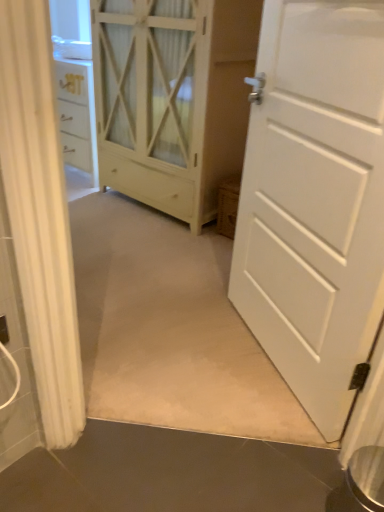
Identify the location of white matte door at right. (315, 200).

Measure the distance between white matte door at right and camera.

They are 37.42 inches apart.

What do you see at coordinates (315, 200) in the screenshot? The width and height of the screenshot is (384, 512). I see `white matte door at right` at bounding box center [315, 200].

What is the approximate width of white wood cupboard at center?

It is 22.03 inches.

Image resolution: width=384 pixels, height=512 pixels. What do you see at coordinates (173, 98) in the screenshot?
I see `white wood cupboard at center` at bounding box center [173, 98].

The image size is (384, 512). What are the coordinates of `white wood cupboard at center` in the screenshot? It's located at (173, 98).

Where is `white matte door at right`? white matte door at right is located at coordinates (315, 200).

Is white matte door at right at the right side of white wood cupboard at center?

Indeed, white matte door at right is positioned on the right side of white wood cupboard at center.

Relative to white wood cupboard at center, is white matte door at right in front or behind?

In the image, white matte door at right appears in front of white wood cupboard at center.

Is point (248, 213) positioned behind point (106, 47)?

No.

From the image's perspective, relative to white wood cupboard at center, is white matte door at right above or below?

white matte door at right is situated lower than white wood cupboard at center in the image.

From a real-world perspective, is white matte door at right physically located above or below white wood cupboard at center?

In terms of real-world spatial position, white matte door at right is below white wood cupboard at center.

In terms of width, does white matte door at right look wider or thinner when compared to white wood cupboard at center?

Considering their sizes, white matte door at right looks slimmer than white wood cupboard at center.

Between white matte door at right and white wood cupboard at center, which one has more height?

Standing taller between the two is white wood cupboard at center.

Which of these two, white matte door at right or white wood cupboard at center, is smaller?

white matte door at right.

Do you think white matte door at right is within white wood cupboard at center, or outside of it?

The correct answer is: outside.

Is white matte door at right directly adjacent to white wood cupboard at center?

No.

Could you tell me if white matte door at right is turned towards white wood cupboard at center?

No, white matte door at right is not turned towards white wood cupboard at center.

Can you tell me how much white matte door at right and white wood cupboard at center differ in facing direction?

30 degrees.

This screenshot has height=512, width=384. Find the location of `cupboard above the white matte door at right (from the image's perspective)`. cupboard above the white matte door at right (from the image's perspective) is located at coordinates (173, 98).

Which is more to the left, white wood cupboard at center or white matte door at right?

Positioned to the left is white wood cupboard at center.

Which object is closer to the camera, white wood cupboard at center or white matte door at right?

white matte door at right is more forward.

Which point is more forward, (95, 51) or (284, 38)?

The point (284, 38) is more forward.

From the image's perspective, does white wood cupboard at center appear lower than white matte door at right?

Actually, white wood cupboard at center appears above white matte door at right in the image.

From a real-world perspective, between white wood cupboard at center and white matte door at right, who is vertically lower?

white matte door at right, from a real-world perspective.

Considering the sizes of objects white wood cupboard at center and white matte door at right in the image provided, who is thinner, white wood cupboard at center or white matte door at right?

white matte door at right is thinner.

From the picture: Who is taller, white wood cupboard at center or white matte door at right?

white wood cupboard at center is taller.

Does white wood cupboard at center have a larger size compared to white matte door at right?

Yes.

Is white wood cupboard at center surrounding white matte door at right?

No, white matte door at right is not surrounded by white wood cupboard at center.

Are white wood cupboard at center and white matte door at right located far from each other?

That's right, there is a large distance between white wood cupboard at center and white matte door at right.

Could you tell me if white wood cupboard at center is facing white matte door at right?

No, white wood cupboard at center does not turn towards white matte door at right.

You are a GUI agent. You are given a task and a screenshot of the screen. Output one action in this format:
    pyautogui.click(x=<x>, y=<y>)
    Task: Click on the door in front of the white wood cupboard at center
    
    Given the screenshot: What is the action you would take?
    pyautogui.click(x=315, y=200)

Find the location of `cupboard that appears on the left of white matte door at right`. cupboard that appears on the left of white matte door at right is located at coordinates (173, 98).

Identify the location of cupboard located above the white matte door at right (from the image's perspective). This screenshot has height=512, width=384. coord(173,98).